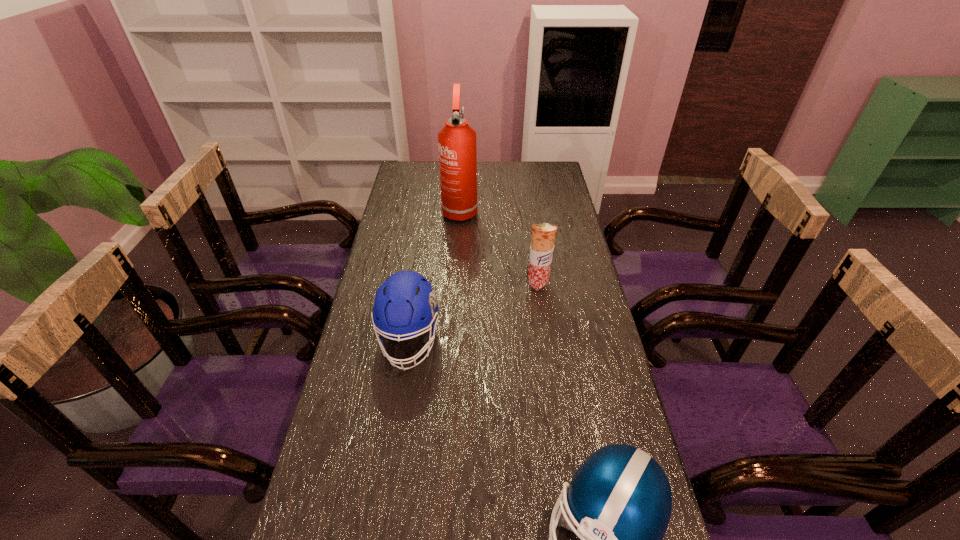
Locate an element on the screen. The width and height of the screenshot is (960, 540). the farthest object is located at coordinates (456, 140).

Image resolution: width=960 pixels, height=540 pixels. Identify the location of the tallest object. (456, 140).

Find the location of a particular element. burrito is located at coordinates (543, 235).

The width and height of the screenshot is (960, 540). Find the location of `the farther football helmet`. the farther football helmet is located at coordinates click(x=405, y=304).

I want to click on the third farthest object, so (x=405, y=304).

You are a GUI agent. You are given a task and a screenshot of the screen. Output one action in this format:
    pyautogui.click(x=<x>, y=<y>)
    Task: Click on the vacant space positioned at the nozzle of the tallest object
    The width and height of the screenshot is (960, 540).
    Given the screenshot: What is the action you would take?
    pyautogui.click(x=458, y=239)

In order to click on vacant space located 0.130m on the left of the third nearest object in this screenshot , I will do `click(487, 284)`.

In order to click on free location located on the front-facing side of the farther football helmet in this screenshot , I will do (397, 417).

Find the location of `object positioned at the left edge`. object positioned at the left edge is located at coordinates (405, 304).

Find the location of a particular element. Image resolution: width=960 pixels, height=540 pixels. object situated at the right edge is located at coordinates (543, 235).